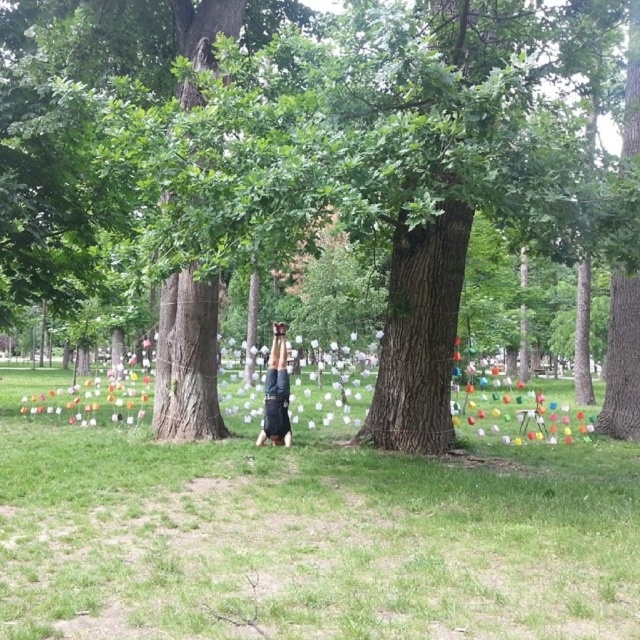
Can you confirm if green rough bark tree at center is taller than black fabric person at center?

Yes, green rough bark tree at center is taller than black fabric person at center.

Who is shorter, green rough bark tree at center or black fabric person at center?

With less height is black fabric person at center.

This screenshot has width=640, height=640. What do you see at coordinates (316, 166) in the screenshot?
I see `green rough bark tree at center` at bounding box center [316, 166].

Locate an element on the screen. This screenshot has height=640, width=640. green rough bark tree at center is located at coordinates (316, 166).

Does green rough bark tree at center lie behind green grass at center?

Yes, green rough bark tree at center is further from the viewer.

Describe the element at coordinates (316, 166) in the screenshot. I see `green rough bark tree at center` at that location.

Is point (259, 108) less distant than point (385, 588)?

No.

Find the location of `green rough bark tree at center`. green rough bark tree at center is located at coordinates (316, 166).

Measure the distance from green grass at center to black fabric person at center.

green grass at center is 2.39 meters from black fabric person at center.

Does green grass at center have a larger size compared to black fabric person at center?

Yes.

Who is more distant from viewer, (548, 547) or (275, 417)?

Point (275, 417)

This screenshot has height=640, width=640. I want to click on green grass at center, so click(x=307, y=536).